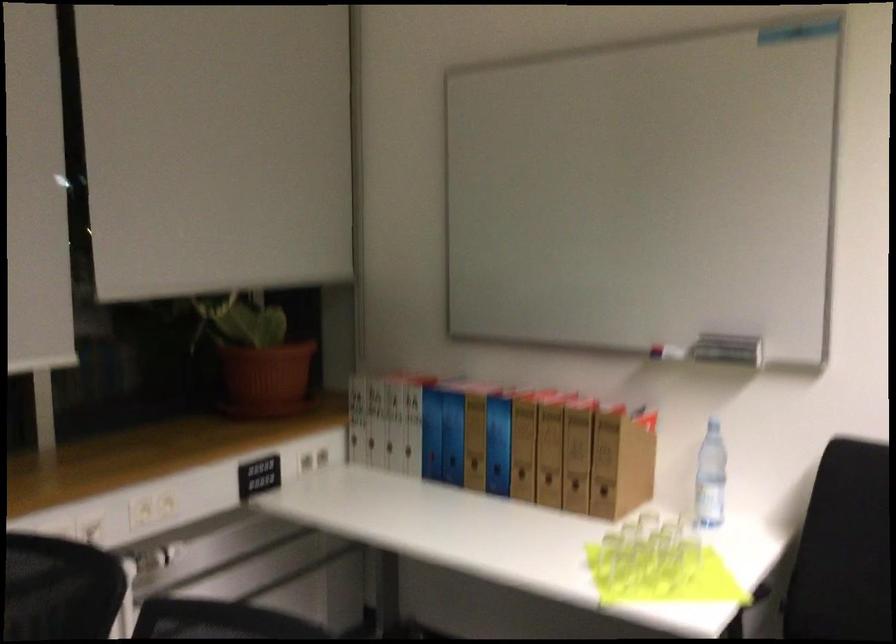
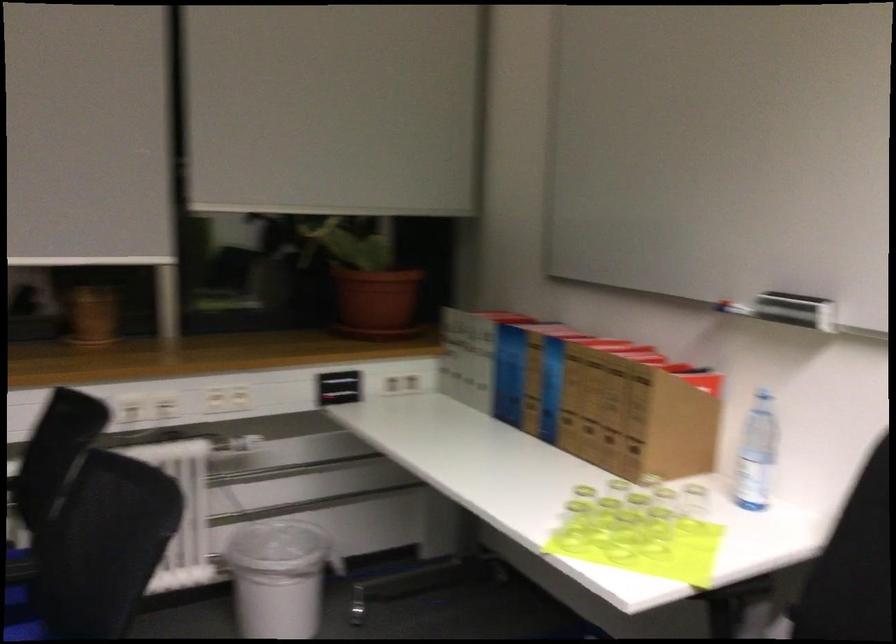
The point at (703, 477) is marked in the first image. Where is the corresponding point in the second image?

(755, 453)